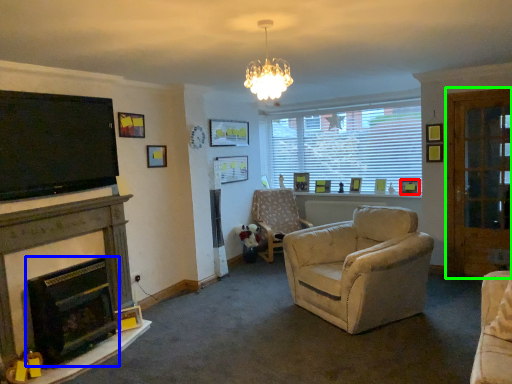
Question: Estimate the real-world distances between objects in this image. Which object is farther from picture frame (highlighted by a red box), fireplace (highlighted by a blue box) or glass door (highlighted by a green box)?

Choices:
 (A) fireplace
 (B) glass door

Answer: (A)